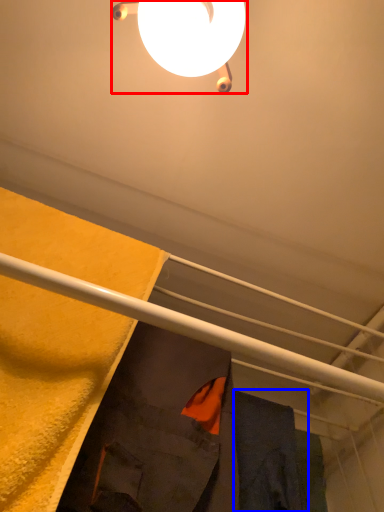
Question: Which of the following is the farthest to the observer, lamp (highlighted by a red box) or robe (highlighted by a blue box)?

Choices:
 (A) lamp
 (B) robe

Answer: (B)